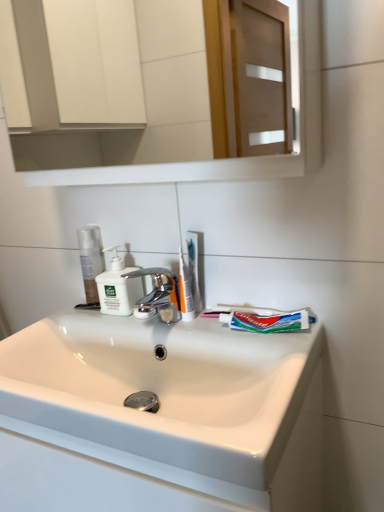
This screenshot has width=384, height=512. In order to click on vacant area in front of green matte toothpaste at center in this screenshot , I will do `click(277, 357)`.